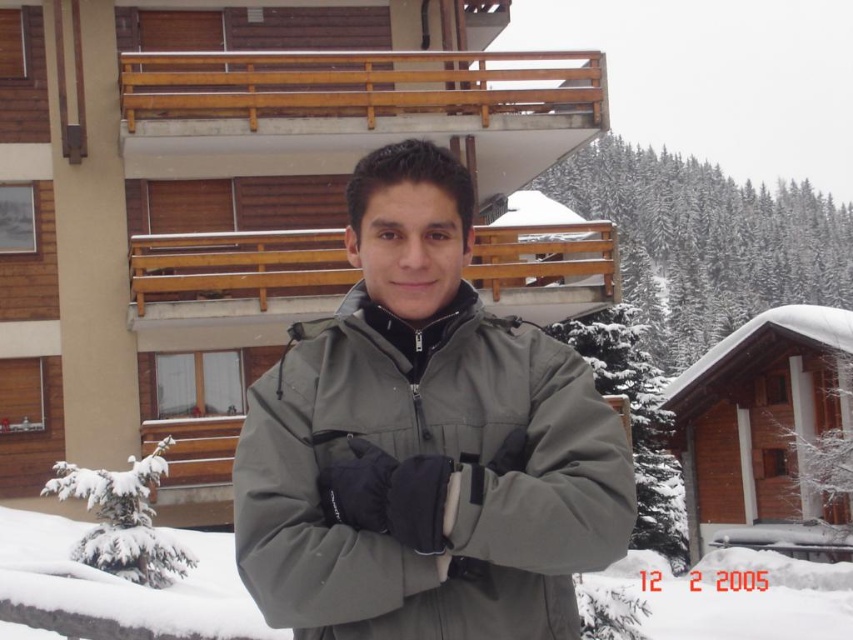
Can you confirm if gray synthetic jacket at center is bigger than white fluffy snow at center?

Incorrect, gray synthetic jacket at center is not larger than white fluffy snow at center.

Which is above, gray synthetic jacket at center or white fluffy snow at center?

Positioned higher is gray synthetic jacket at center.

Is point (486, 326) positioned after point (680, 627)?

No, (486, 326) is in front of (680, 627).

Identify the location of gray synthetic jacket at center. This screenshot has height=640, width=853. (433, 458).